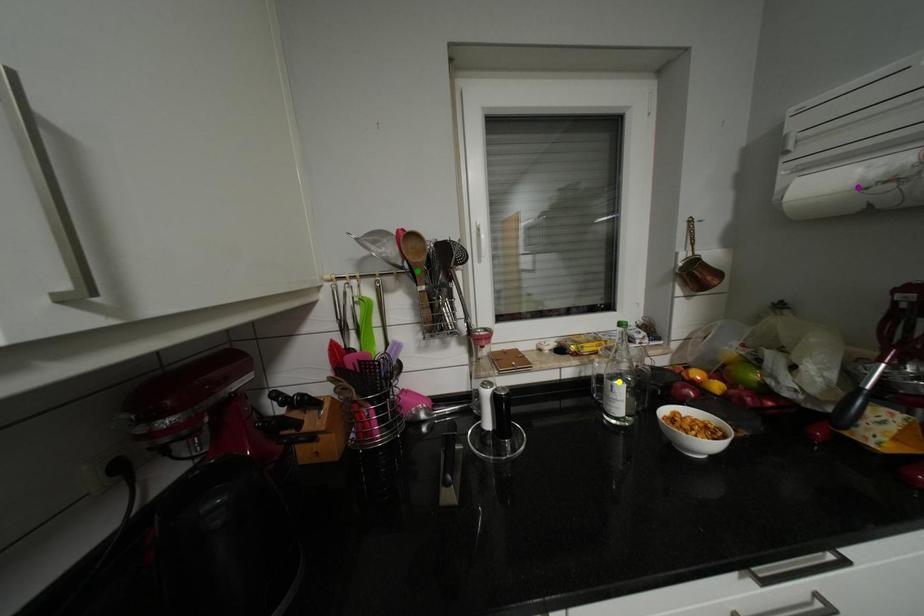
In the scene shown: Order these from nearest to farthest:
- purple point
- yellow point
- green point

purple point → green point → yellow point